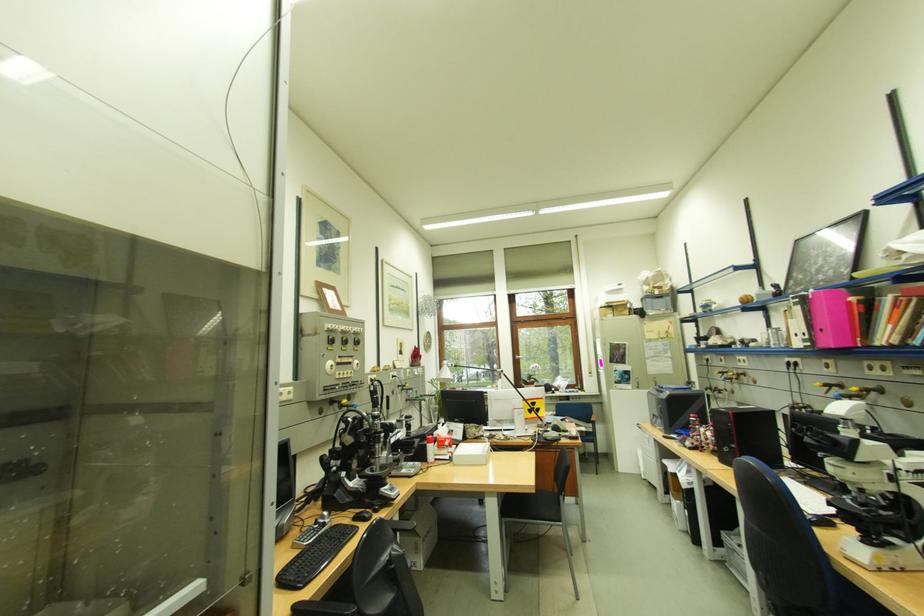
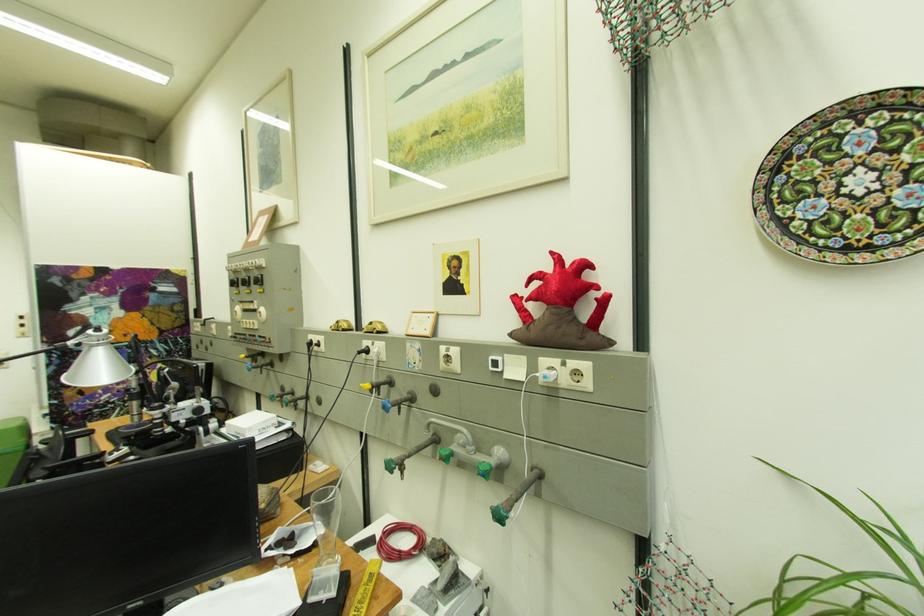
Question: I am providing you with two images of the same scene from different viewpoints. Please identify which objects are invisible in image2.

Choices:
 (A) white cardboard box
 (B) blue valve handle
 (C) small golden toy car
 (D) none of these

Answer: (D)